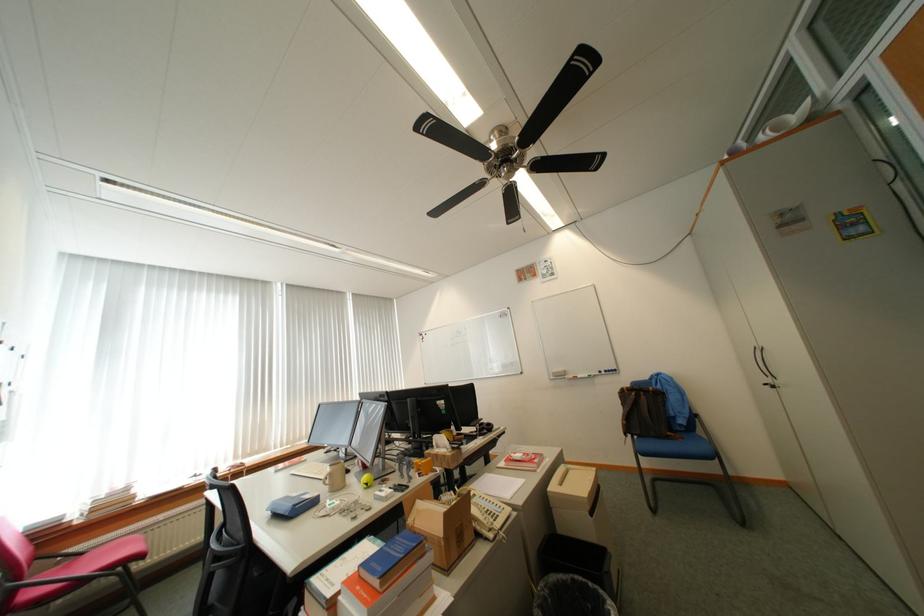
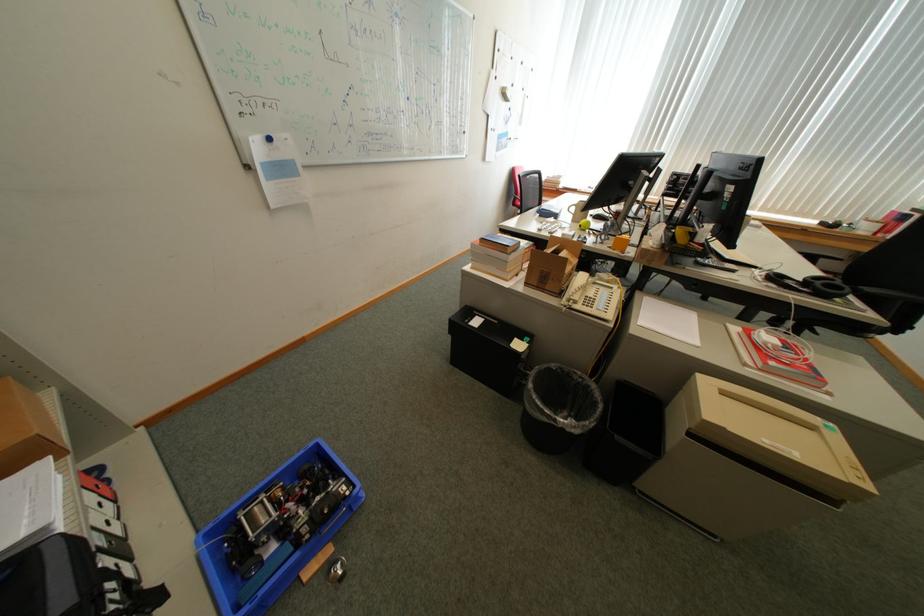
Question: I am providing you with two images of the same scene from different viewpoints. Which of the following objects are not visible in image2?

Choices:
 (A) green rolled paper
 (B) red binder spine
 (C) red chair sitting surface
 (D) blue circular magnet

Answer: (C)